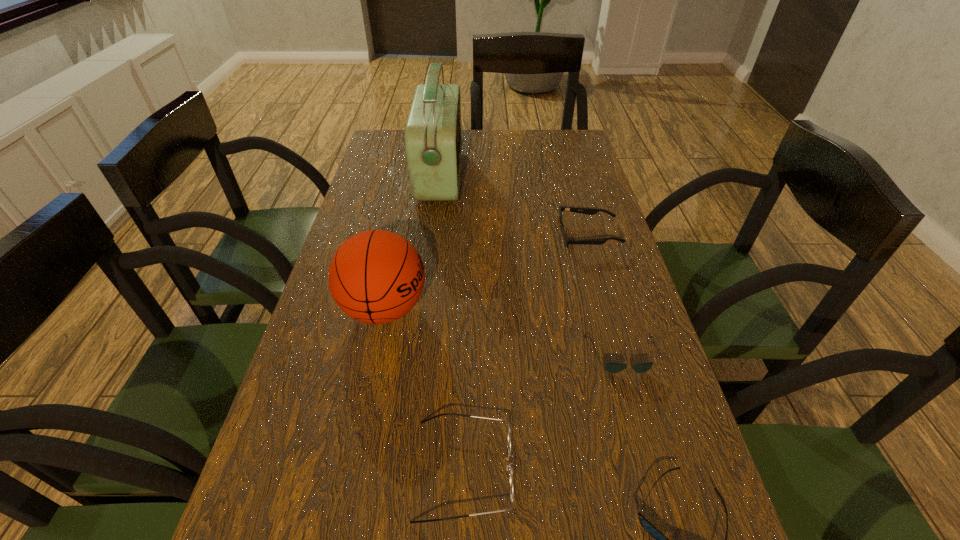
Where is `vacant space positioned on the front-facing side of the third shortest object`? vacant space positioned on the front-facing side of the third shortest object is located at coordinates (492, 236).

Identify the location of blank space located 0.050m on the front-facing side of the third shortest object. (540, 236).

Locate an element on the screen. This screenshot has height=540, width=960. vacant space situated 0.190m on the front-facing side of the third shortest object is located at coordinates (488, 236).

Where is `vacant position located on the lenses of the second farthest sunglasses`? vacant position located on the lenses of the second farthest sunglasses is located at coordinates (634, 397).

At what (x,y) coordinates should I click in order to perform the action: click on object positioned at the far edge. Please return your answer as a coordinate pair (x, y). Image resolution: width=960 pixels, height=540 pixels. Looking at the image, I should click on (433, 140).

Find the location of `object that is at the left edge`. object that is at the left edge is located at coordinates tap(376, 276).

Image resolution: width=960 pixels, height=540 pixels. Find the location of `vacant space at the far edge`. vacant space at the far edge is located at coordinates (507, 150).

This screenshot has height=540, width=960. Find the location of `vacant point at the left edge`. vacant point at the left edge is located at coordinates (305, 438).

I want to click on free space at the right edge, so click(x=611, y=244).

Where is `empty space between the second farthest sunglasses and the spectacles`? empty space between the second farthest sunglasses and the spectacles is located at coordinates (543, 413).